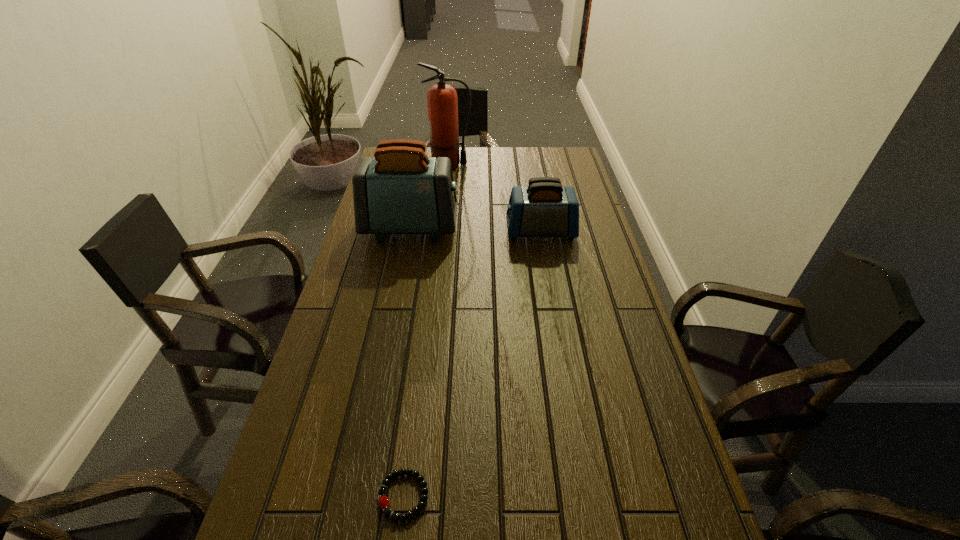
Where is `fire extinguisher`? The width and height of the screenshot is (960, 540). fire extinguisher is located at coordinates (442, 101).

The height and width of the screenshot is (540, 960). I want to click on the farthest object, so click(442, 101).

Locate an element on the screen. the second tallest object is located at coordinates (401, 190).

At what (x,y) coordinates should I click in order to perform the action: click on the left toaster. Please return your answer as a coordinate pair (x, y). This screenshot has width=960, height=540. Looking at the image, I should click on (401, 190).

Locate an element on the screen. The width and height of the screenshot is (960, 540). the rightmost object is located at coordinates (544, 208).

What are the coordinates of `the right toaster` in the screenshot? It's located at (544, 208).

Where is `the shortest object`? the shortest object is located at coordinates (384, 503).

At what (x,y) coordinates should I click in order to perform the action: click on the nearest object. Please return your answer as a coordinate pair (x, y). This screenshot has width=960, height=540. Looking at the image, I should click on (384, 503).

This screenshot has height=540, width=960. In order to click on vacant space situated on the nozzle of the farthest object in this screenshot , I will do `click(492, 165)`.

Where is `vacant space located 0.080m on the front-facing side of the left toaster`? Image resolution: width=960 pixels, height=540 pixels. vacant space located 0.080m on the front-facing side of the left toaster is located at coordinates click(x=481, y=228).